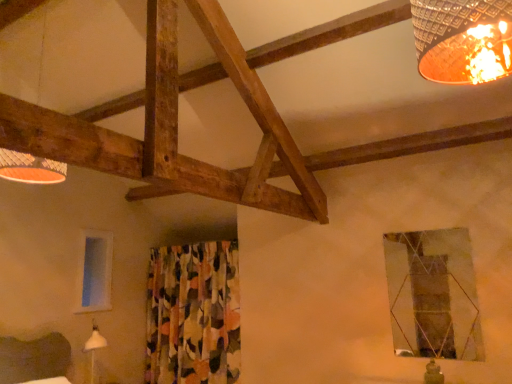
Question: From a real-world perspective, relative to floral fabric curtain at center, is matte wooden lampshade at upper left vertically above or below?

Choices:
 (A) below
 (B) above

Answer: (B)

Question: From the image's perspective, is matte wooden lampshade at upper left positioned above or below floral fabric curtain at center?

Choices:
 (A) above
 (B) below

Answer: (A)

Question: Which object is the farthest from the metallic reflective window at upper right, the 1th window in the right-to-left sequence?

Choices:
 (A) matte wooden lampshade at upper left
 (B) floral fabric curtain at center
 (C) transparent glass window at left, placed as the second window when sorted from front to back

Answer: (C)

Question: Based on their relative distances, which object is nearer to the transparent glass window at left, which is the first window from left to right?

Choices:
 (A) metallic reflective window at upper right, which ranks as the 2th window in back-to-front order
 (B) matte wooden lampshade at upper left
 (C) floral fabric curtain at center

Answer: (C)